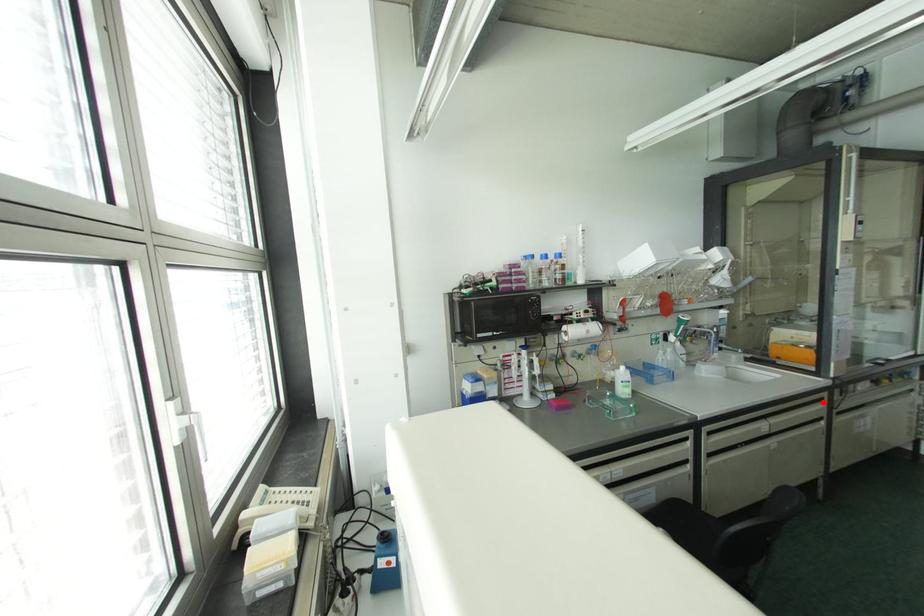
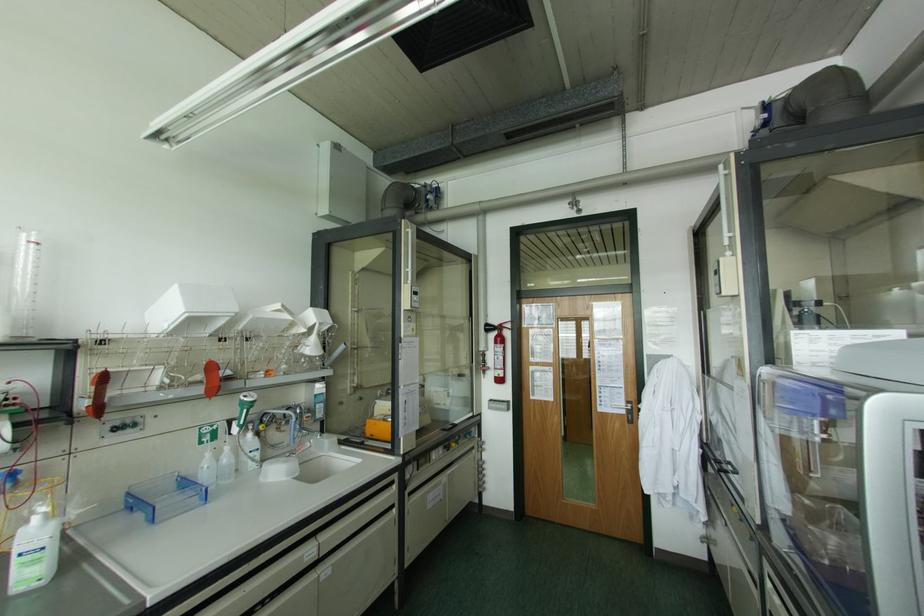
Question: I am providing you with two images of the same scene from different viewpoints. A red point is shown in image1. For the corresponding object point in image2, is it positioned nearer or farther from the camera?

Choices:
 (A) Nearer
 (B) Farther

Answer: (B)